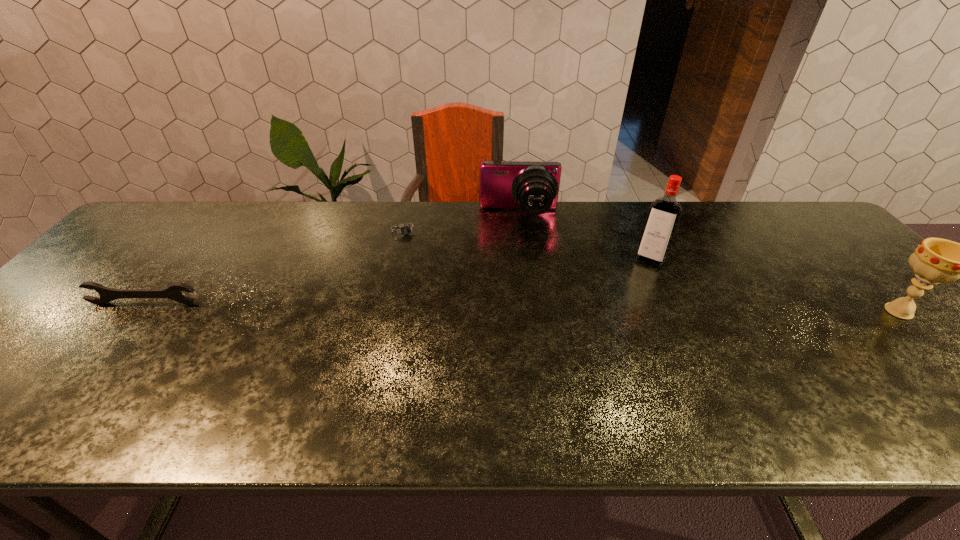
I want to click on free space between the leftmost object and the third tallest object, so click(x=332, y=259).

Locate an element on the screen. The width and height of the screenshot is (960, 540). vacant space in between the wrench and the third farthest object is located at coordinates (397, 281).

Where is `empty space that is in between the wrench and the watch`? This screenshot has height=540, width=960. empty space that is in between the wrench and the watch is located at coordinates (276, 267).

At what (x,y) coordinates should I click in order to perform the action: click on free space between the rightmost object and the third nearest object. Please return your answer as a coordinate pair (x, y). Looking at the image, I should click on (775, 285).

Locate an element on the screen. free space between the chalice and the second object from left to right is located at coordinates (652, 271).

Identify the location of free spot between the camera and the second shortest object. Image resolution: width=960 pixels, height=540 pixels. (332, 259).

The width and height of the screenshot is (960, 540). I want to click on vacant space that is in between the fourth object from left to right and the chalice, so click(775, 285).

This screenshot has width=960, height=540. What are the coordinates of `free space between the third shortest object and the rightmost object` in the screenshot? It's located at (708, 263).

What are the coordinates of `free area in between the second object from left to right and the tallest object` in the screenshot? It's located at (528, 245).

Locate which object ranks in proximity to the leftmost object. Please provide its 2D coordinates. Your answer should be formatted as a tuple, i.e. [(x, y)], where the tuple contains the x and y coordinates of a point satisfying the conditions above.

[(405, 230)]